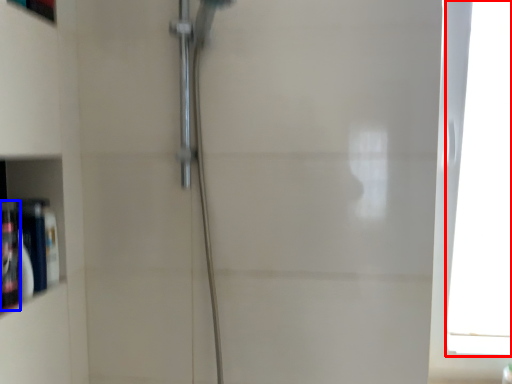
Question: Which point is closer to the camera, window (highlighted by a red box) or toiletry (highlighted by a blue box)?

Choices:
 (A) window
 (B) toiletry

Answer: (B)